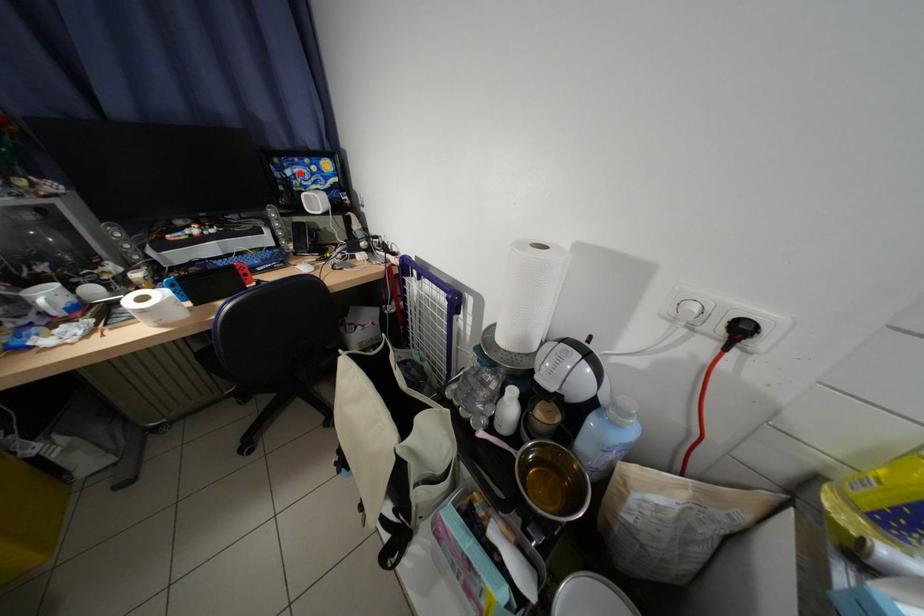
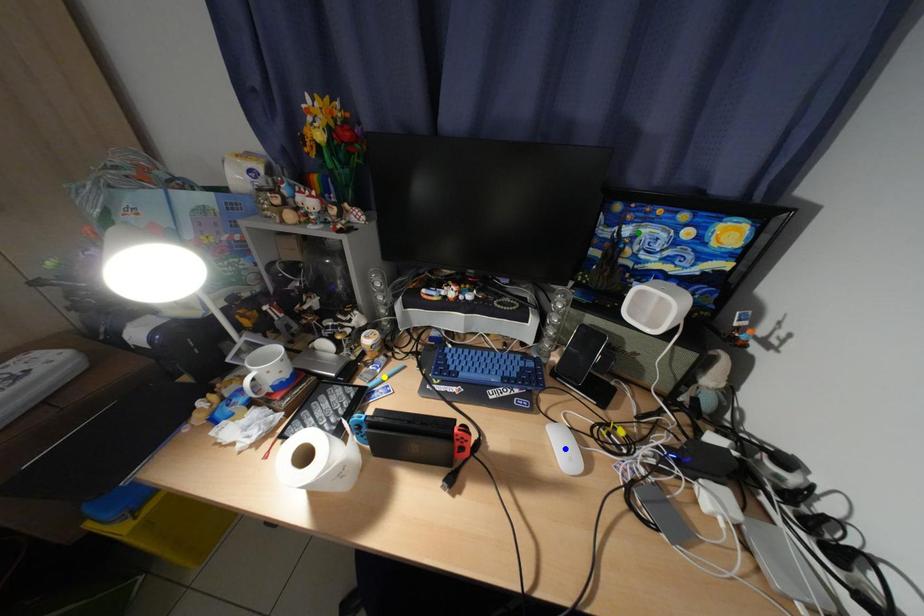
Question: I am providing you with two images of the same scene from different viewpoints. A red point is marked on the first image. You are given multiple points on the second image. Which spot in image 2 lines up with the point in image 1?

Choices:
 (A) blue point
 (B) green point
 (C) yellow point

Answer: (B)